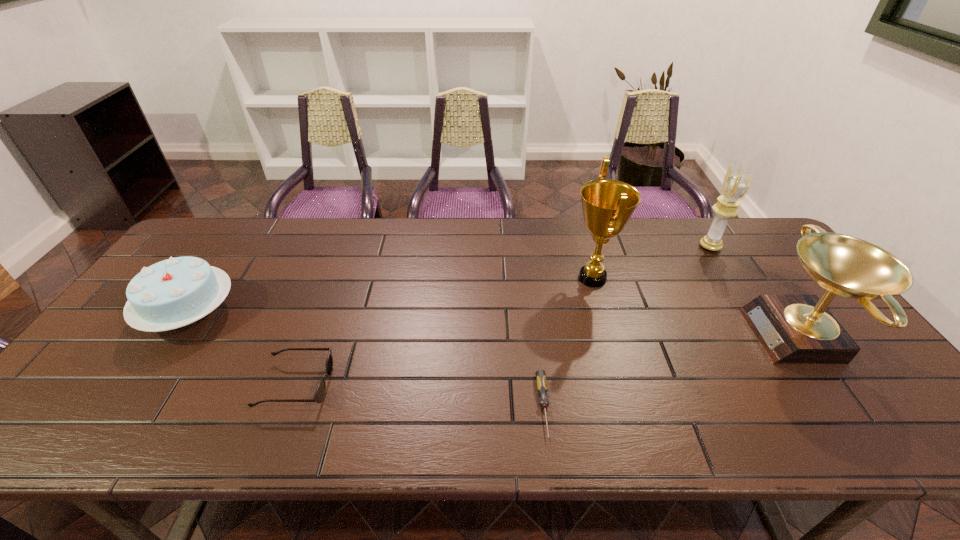
You are a GUI agent. You are given a task and a screenshot of the screen. Output one action in this format:
    pyautogui.click(x=<x>, y=<y>)
    Task: Click on the free spot located 0.280m on the front view with handles of the tallest object
    
    Given the screenshot: What is the action you would take?
    pyautogui.click(x=473, y=278)

You are a GUI agent. You are given a task and a screenshot of the screen. Output one action in this format:
    pyautogui.click(x=<x>, y=<y>)
    Task: Click on the free space located 0.350m on the front view with handles of the tallest object
    This screenshot has width=960, height=540.
    Given the screenshot: What is the action you would take?
    pyautogui.click(x=450, y=278)

Find the location of `free spot located 0.220m on the front-facing side of the farthest object`. free spot located 0.220m on the front-facing side of the farthest object is located at coordinates (632, 247).

You are a GUI agent. You are given a task and a screenshot of the screen. Output one action in this format:
    pyautogui.click(x=<x>, y=<y>)
    Task: Click on the free region located 0.120m on the front-facing side of the farthest object
    This screenshot has width=960, height=540.
    Given the screenshot: What is the action you would take?
    pyautogui.click(x=662, y=247)

Where is `free region located on the front-facing side of the farthest object`? This screenshot has height=540, width=960. free region located on the front-facing side of the farthest object is located at coordinates (580, 247).

Find the location of a particular element. Image resolution: width=960 pixels, height=540 pixels. free space located 0.400m on the right of the fourth tallest object is located at coordinates (381, 313).

Locate an element on the screen. The width and height of the screenshot is (960, 540). free space located 0.270m on the front lenses of the second object from left to right is located at coordinates (444, 385).

At what (x,y) coordinates should I click in order to perform the action: click on sunglasses that is at the near edge. Please return your answer as a coordinate pair (x, y). The height and width of the screenshot is (540, 960). Looking at the image, I should click on (319, 395).

You are a GUI agent. You are given a task and a screenshot of the screen. Output one action in this format:
    pyautogui.click(x=<x>, y=<y>)
    Task: Click on the screwdriver located at the near edge
    
    Given the screenshot: What is the action you would take?
    pyautogui.click(x=541, y=381)

Where is `object that is at the left edge`? This screenshot has height=540, width=960. object that is at the left edge is located at coordinates (172, 293).